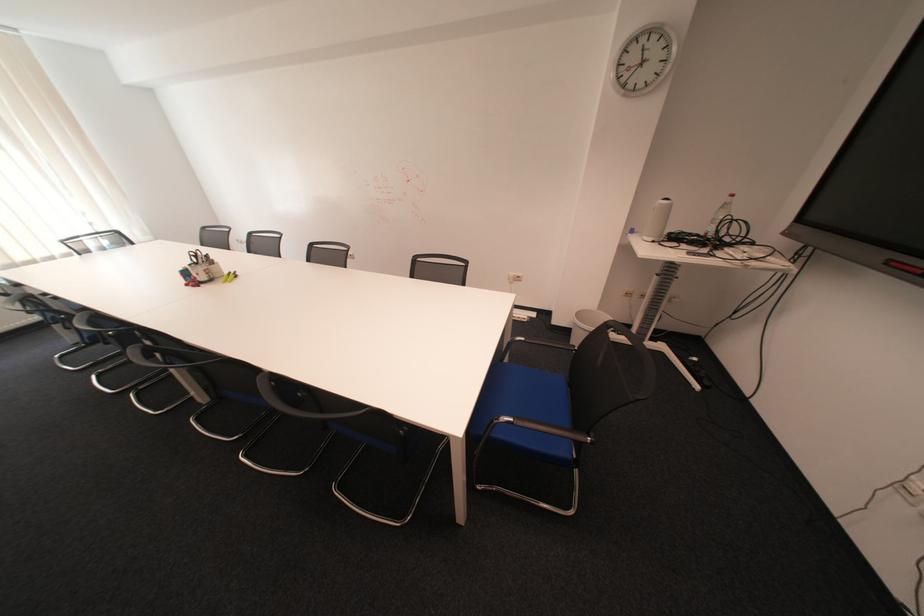
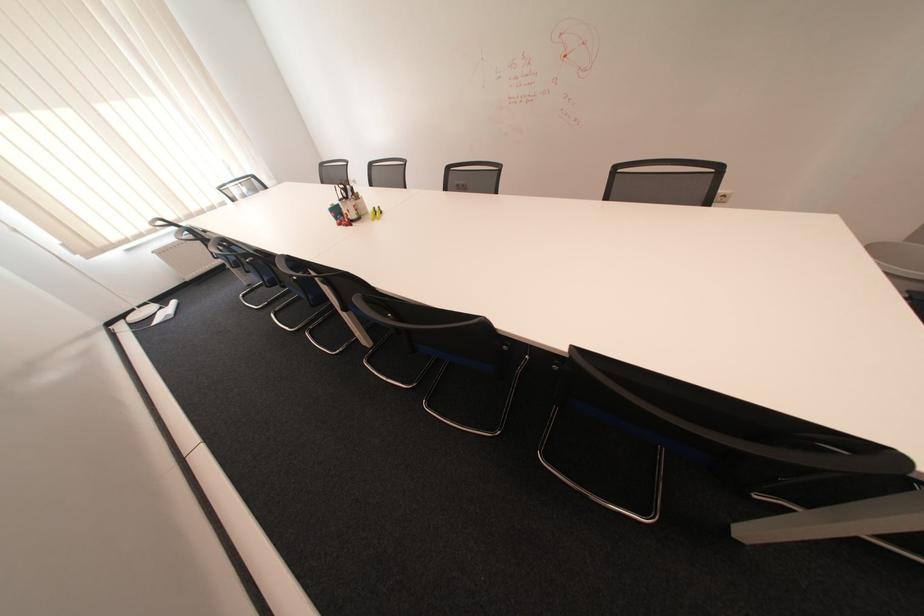
The images are taken continuously from a first-person perspective. In which direction are you moving?

The cameraman moved toward left, forward.